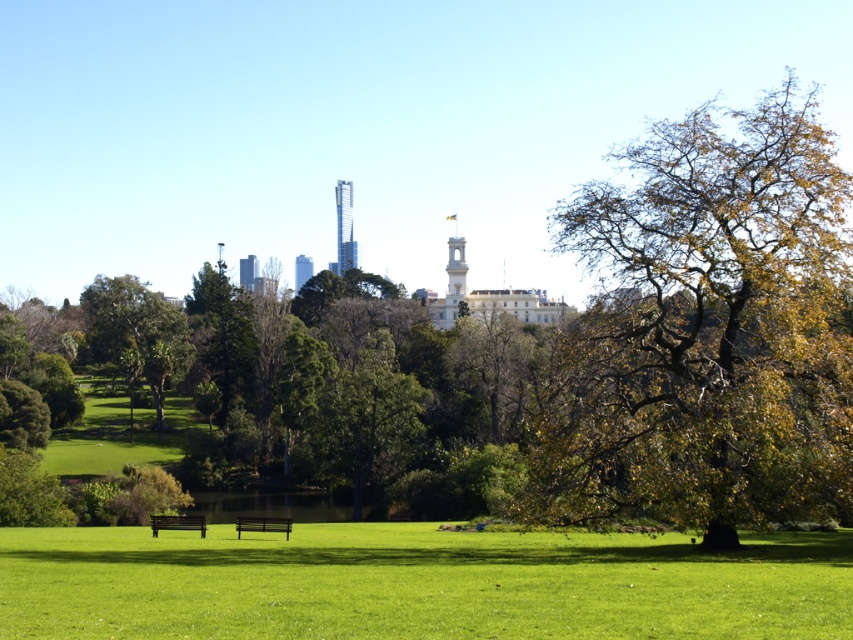
You are a photographer planning to capture a wide shot of the park. You want to ensure both the wooden bench at center and the smooth glass skyscraper at center are clearly visible in the frame. Given their sizes, which object might require you to adjust your camera angle to avoid it being too small or too large in the photo?

The wooden bench at center is smaller than the smooth glass skyscraper at center. To ensure both are clearly visible, you may need to adjust the camera angle to prevent the skyscraper from dominating the frame or the bench appearing too small.

You are standing in the park and want to walk towards the two points marked in the image. Which point, point (200, 525) or point (294, 272), will you reach first?

You will reach point (200, 525) first because it is closer to you than point (294, 272).

You are standing at the point labeled as point (416,582) in the park. What is the terrain like at that location?

The point (416,582) indicates green grassy field at lower center.